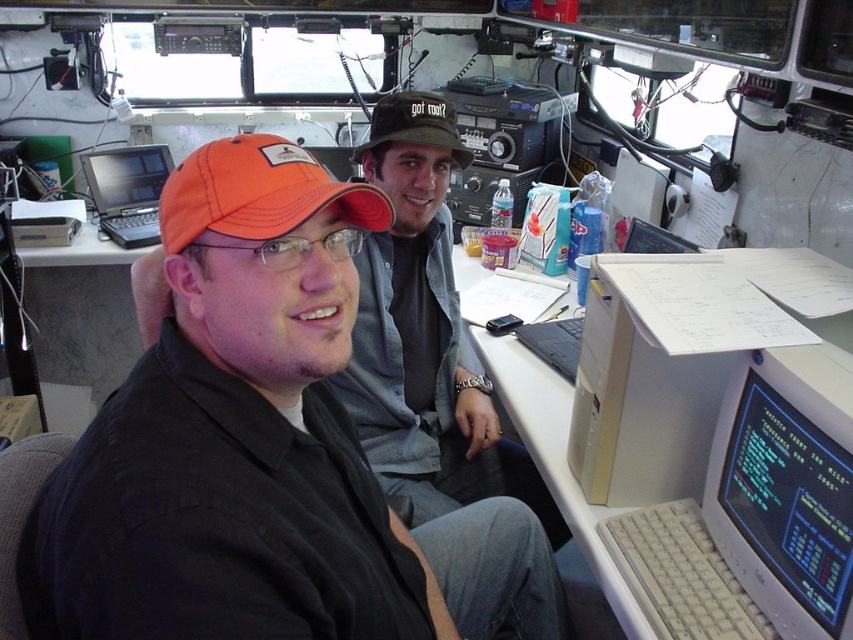
You are a technician who needs to locate the matte black laptop at left in the control room. What are its coordinates?

The matte black laptop at left is located at coordinates point (126,192).

You are a technician standing between the two people in the image. You need to reach the matte gray monitor at lower right to perform a system check. Considering your height and the monitor placement, can you comfortably access it without stretching too much?

The matte gray monitor at lower right is positioned at a standard height for such monitors, so yes, you can comfortably access it without stretching too much.

You are a technician in the control room and need to access both the point at coordinates point (131, 161) and the point at coordinates point (535, 342). Which coordinate point is closer to you?

Point (131, 161) is closer to you because it is further to the camera than point (535, 342), meaning it is nearer in the scene.